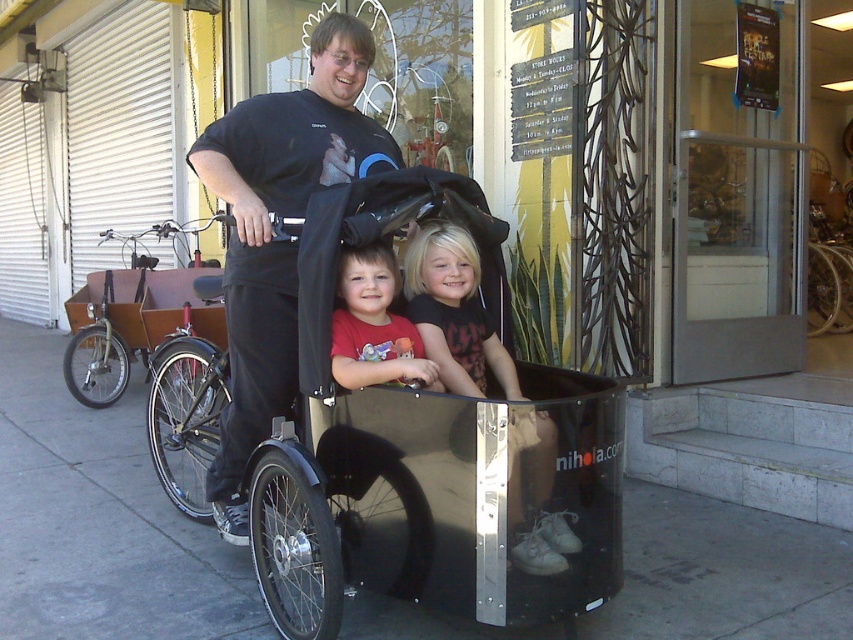
You are a photographer trying to capture a clear photo of both the black matte shirt at center and the matte red shirt at center. Since you want both shirts to be in focus, you need to adjust your camera settings. Considering their sizes, which shirt should you focus on to ensure both are sharp?

The black matte shirt at center is much taller than the matte red shirt at center, so focusing on the black matte shirt at center will help keep both shirts in focus as it is the larger subject.

You are a photographer setting up a tripod to capture a photo of the shiny black cargo bike at center and the matte red shirt at center. If you want to ensure both subjects are in focus, which one should you adjust the focus on first?

Since the shiny black cargo bike at center is bigger than the matte red shirt at center, you should focus on the shiny black cargo bike at center first as it requires more precise focus due to its larger size.